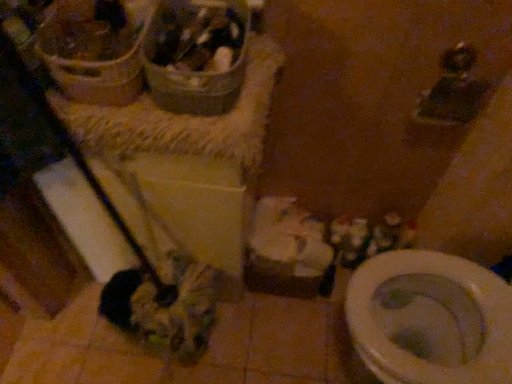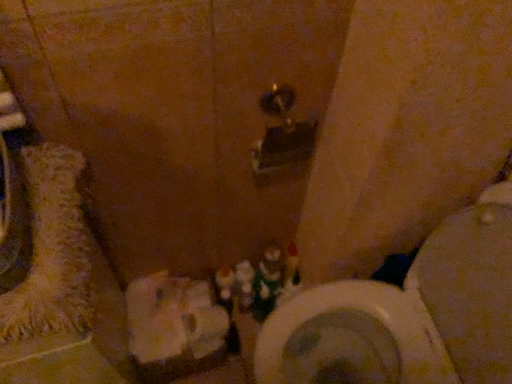
Question: How did the camera likely rotate when shooting the video?

Choices:
 (A) rotated left
 (B) rotated right

Answer: (B)